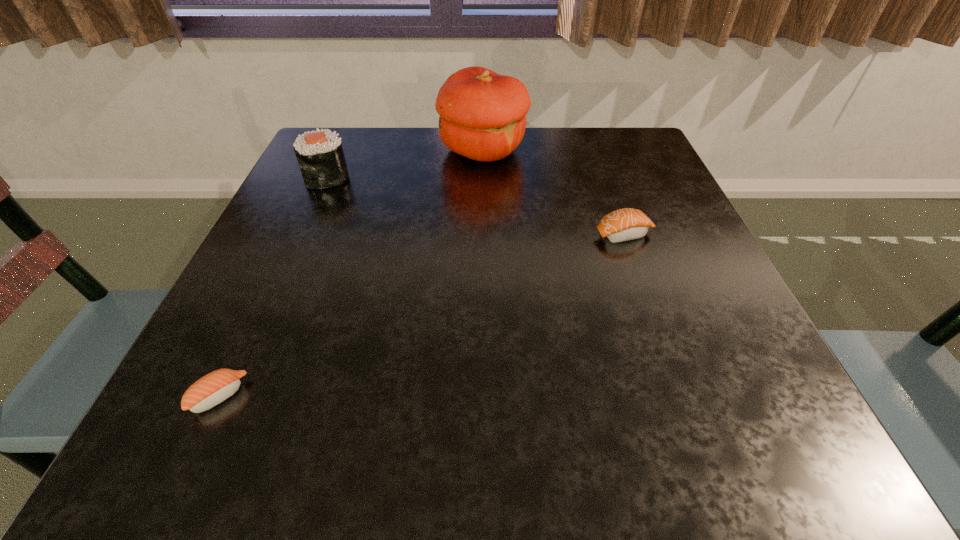
In the image, there is a desktop. Where is `vacant space at the right edge`? vacant space at the right edge is located at coordinates (662, 295).

In the image, there is a desktop. Identify the location of vacant space at the far left corner. (354, 161).

Identify the location of free space at the far right corner of the desktop. This screenshot has width=960, height=540. (629, 146).

Where is `free spot between the nearest object and the farthest sushi`? The image size is (960, 540). free spot between the nearest object and the farthest sushi is located at coordinates (273, 286).

Locate an element on the screen. free space that is in between the nearest object and the rightmost sushi is located at coordinates (421, 315).

In order to click on empty space that is in between the tallest sushi and the nearest sushi in this screenshot , I will do `click(273, 286)`.

At what (x,y) coordinates should I click in order to perform the action: click on free space that is in between the nearest object and the third shortest object. Please return your answer as a coordinate pair (x, y). The height and width of the screenshot is (540, 960). Looking at the image, I should click on (273, 286).

Find the location of `free space that is in between the nearest sushi and the pumpkin`. free space that is in between the nearest sushi and the pumpkin is located at coordinates (351, 273).

At what (x,y) coordinates should I click in order to perform the action: click on vacant space that is in between the tallest sushi and the tallest object. Please return your answer as a coordinate pair (x, y). Image resolution: width=960 pixels, height=540 pixels. Looking at the image, I should click on (405, 164).

Identify the location of vacant area that lies between the second tallest object and the rightmost sushi. This screenshot has width=960, height=540. (475, 206).